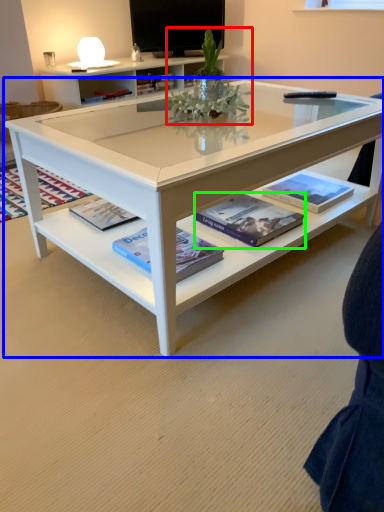
Question: Which object is positioned closest to floral arrangement (highlighted by a red box)? Select from coffee table (highlighted by a blue box) and book (highlighted by a green box).

Choices:
 (A) coffee table
 (B) book

Answer: (B)